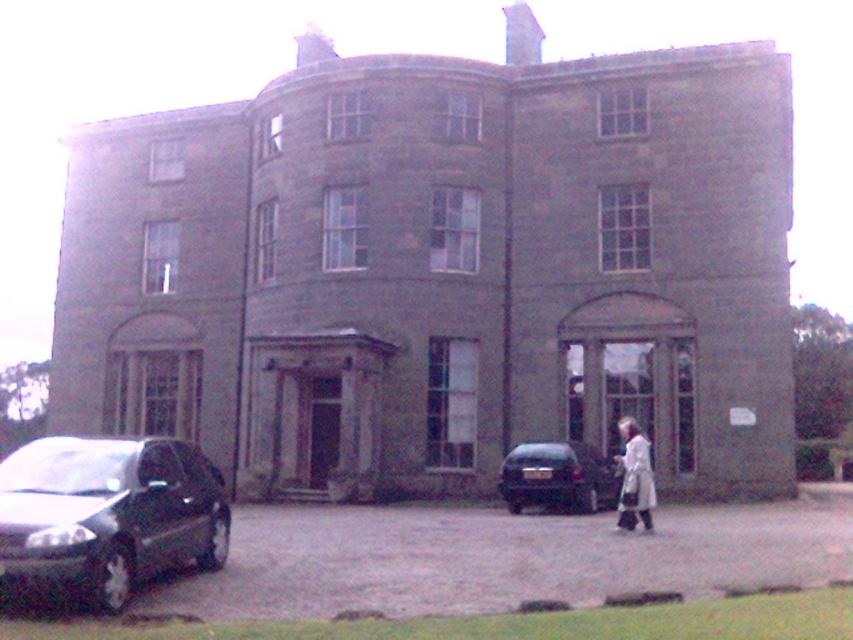
Question: Can you confirm if gray asphalt driveway at lower center is smaller than white clothed figure at center?

Choices:
 (A) yes
 (B) no

Answer: (B)

Question: Which point is farther to the camera?

Choices:
 (A) (625, 547)
 (B) (608, 484)

Answer: (B)

Question: Among these objects, which one is nearest to the camera?

Choices:
 (A) shiny black car at lower center
 (B) gray asphalt driveway at lower center
 (C) shiny black car at lower left

Answer: (C)

Question: Which of the following is the closest to the observer?

Choices:
 (A) gray asphalt driveway at lower center
 (B) shiny black car at lower center
 (C) white clothed figure at center
 (D) shiny black car at lower left

Answer: (D)

Question: Can you confirm if shiny black car at lower left is positioned below white clothed figure at center?

Choices:
 (A) yes
 (B) no

Answer: (B)

Question: Observing the image, what is the correct spatial positioning of gray asphalt driveway at lower center in reference to shiny black car at lower center?

Choices:
 (A) above
 (B) below

Answer: (B)